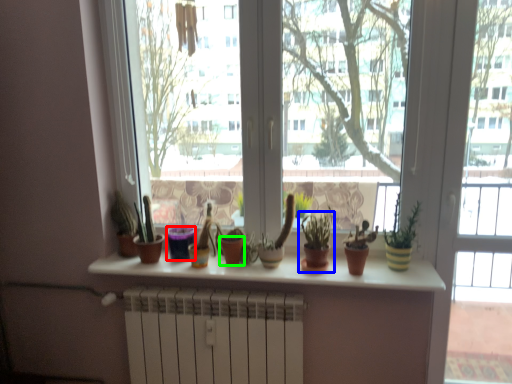
Question: Estimate the real-world distances between objects in this image. Which object is farther from flowerpot (highlighted by a red box), houseplant (highlighted by a blue box) or flowerpot (highlighted by a green box)?

Choices:
 (A) houseplant
 (B) flowerpot

Answer: (A)